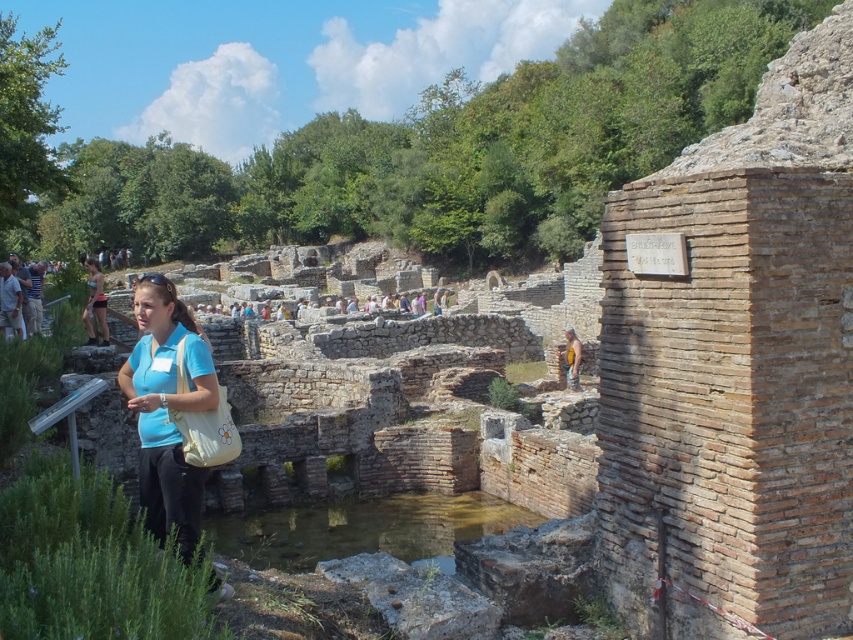
A tourist is wearing a matte blue shirt at center and matte black shorts at center. Which clothing item has a greater width?

The matte black shorts at center has a greater width than the matte blue shirt at center.

You are a tour guide at the archaeological site. You notice a tourist holding a beige bag with a floral design and wearing matte black shorts at center. They ask if the clear stone water at center is bigger than their shorts. How do you respond?

The clear stone water at center occupies less space than the matte black shorts at center, so no, the clear stone water at center is not bigger than the matte black shorts at center.